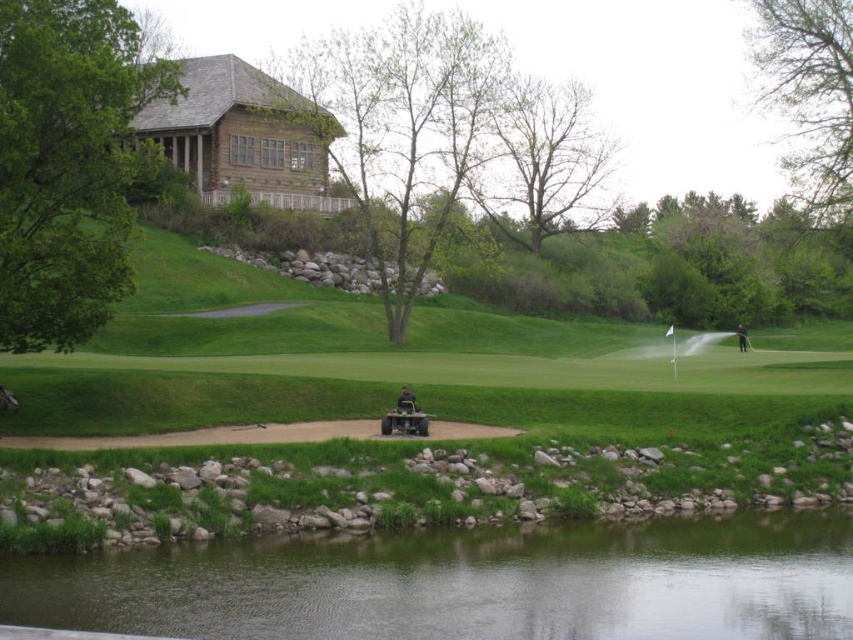
Question: Among these objects, which one is nearest to the camera?

Choices:
 (A) transparent water at lower center
 (B) green fabric shirt at center

Answer: (A)

Question: Does transparent water at lower center have a greater width compared to green fabric shirt at center?

Choices:
 (A) yes
 (B) no

Answer: (A)

Question: Does transparent water at lower center have a lesser width compared to green fabric shirt at center?

Choices:
 (A) yes
 (B) no

Answer: (B)

Question: Which object is farther from the camera taking this photo?

Choices:
 (A) green fabric shirt at center
 (B) transparent water at lower center

Answer: (A)

Question: Does transparent water at lower center have a greater width compared to green fabric shirt at center?

Choices:
 (A) no
 (B) yes

Answer: (B)